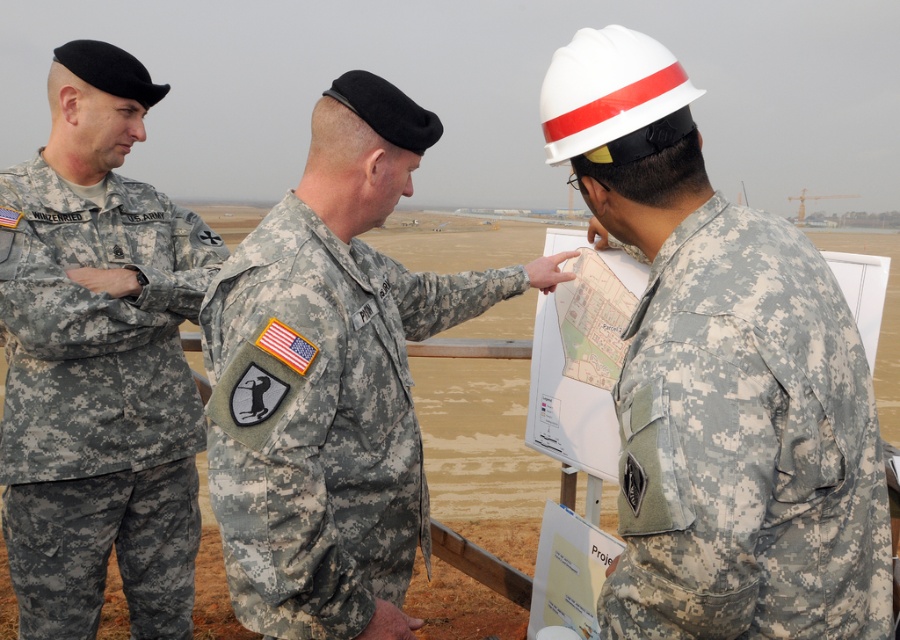
Locate an element on the screen. This screenshot has height=640, width=900. camouflage fabric uniform at right is located at coordinates (747, 445).

Is camouflage fabric uniform at right below camouflage fabric uniform at left?

Actually, camouflage fabric uniform at right is above camouflage fabric uniform at left.

Is point (700, 513) farther from viewer compared to point (77, 502)?

That is False.

Where is `camouflage fabric uniform at right`? This screenshot has width=900, height=640. camouflage fabric uniform at right is located at coordinates (747, 445).

Who is higher up, camouflage fabric uniform at center or camouflage fabric uniform at left?

Positioned higher is camouflage fabric uniform at center.

Is camouflage fabric uniform at center to the left of camouflage fabric uniform at left from the viewer's perspective?

Incorrect, camouflage fabric uniform at center is not on the left side of camouflage fabric uniform at left.

Does point (302, 440) come behind point (93, 564)?

No, (302, 440) is in front of (93, 564).

Identify the location of camouflage fabric uniform at center. tap(321, 419).

Is camouflage fabric uniform at right closer to camera compared to camouflage fabric uniform at center?

That is True.

From the picture: Is camouflage fabric uniform at right further to the viewer compared to camouflage fabric uniform at center?

That is False.

Does point (762, 481) lie behind point (257, 552)?

No, it is in front of (257, 552).

Identify the location of camouflage fabric uniform at right. The width and height of the screenshot is (900, 640). coord(747,445).